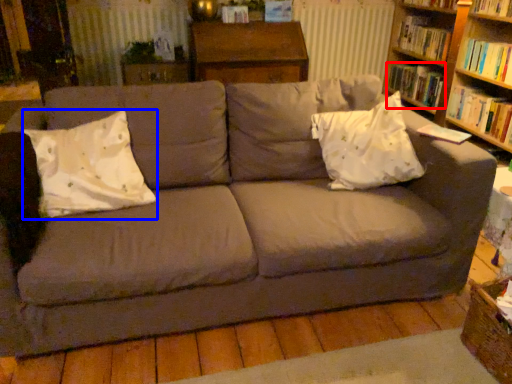
Question: Which object appears farthest to the camera in this image, book (highlighted by a red box) or throw pillow (highlighted by a blue box)?

Choices:
 (A) book
 (B) throw pillow

Answer: (A)